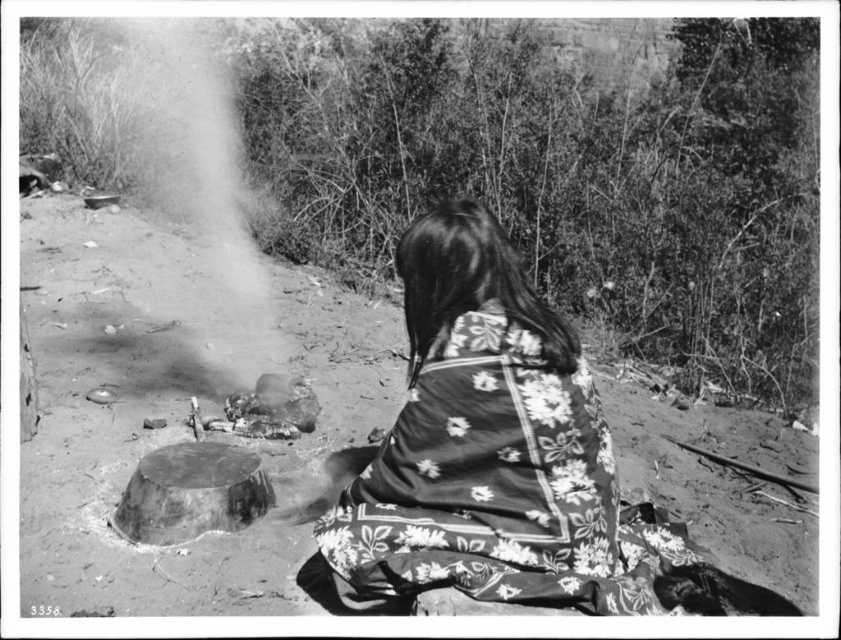
You are a traveler who just arrived at this historical outdoor scene. You notice a point marked at coordinates (484,444). What object is located at this point?

The object located at point (484,444) is the floral fabric shawl at center.

Based on the photo, you are standing at the center of the scene and want to walk to one of the two points. Which point, point [574,344] or point [191,88], is closer to you?

Point [574,344] is closer to the viewer than point [191,88], so you should walk to point [574,344] first.